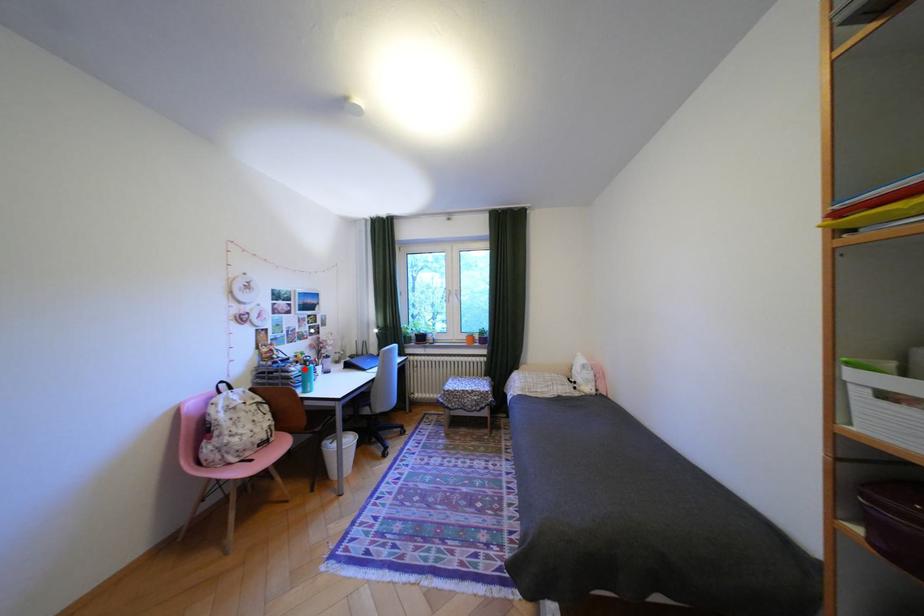
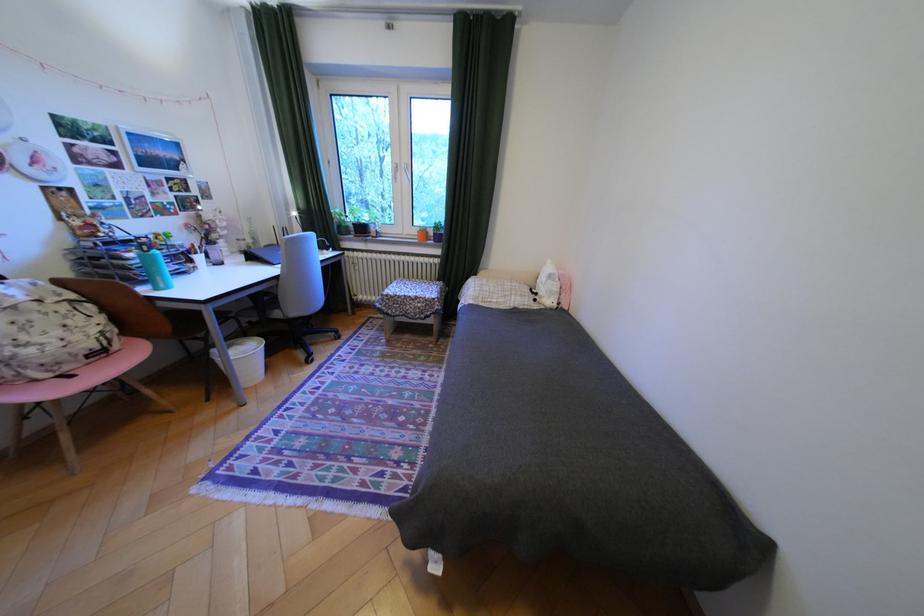
The point at the highlighted location is marked in the first image. Where is the corresponding point in the second image?

(140, 254)